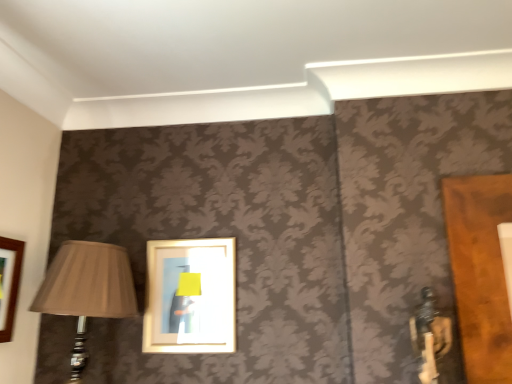
Question: From the image's perspective, is matte brown lampshade at left located above or below wooden frame at center?

Choices:
 (A) above
 (B) below

Answer: (B)

Question: In the image, is matte brown lampshade at left positioned in front of or behind wooden frame at center?

Choices:
 (A) front
 (B) behind

Answer: (A)

Question: Is matte brown lampshade at left to the left or to the right of wooden frame at center in the image?

Choices:
 (A) right
 (B) left

Answer: (B)

Question: Looking at the image, does wooden frame at center seem bigger or smaller compared to matte brown lampshade at left?

Choices:
 (A) small
 (B) big

Answer: (A)

Question: Considering the positions of wooden frame at center and matte brown lampshade at left in the image, is wooden frame at center taller or shorter than matte brown lampshade at left?

Choices:
 (A) short
 (B) tall

Answer: (A)

Question: From a real-world perspective, relative to matte brown lampshade at left, is wooden frame at center vertically above or below?

Choices:
 (A) below
 (B) above

Answer: (B)

Question: Is point (210, 294) closer or farther from the camera than point (116, 291)?

Choices:
 (A) farther
 (B) closer

Answer: (A)